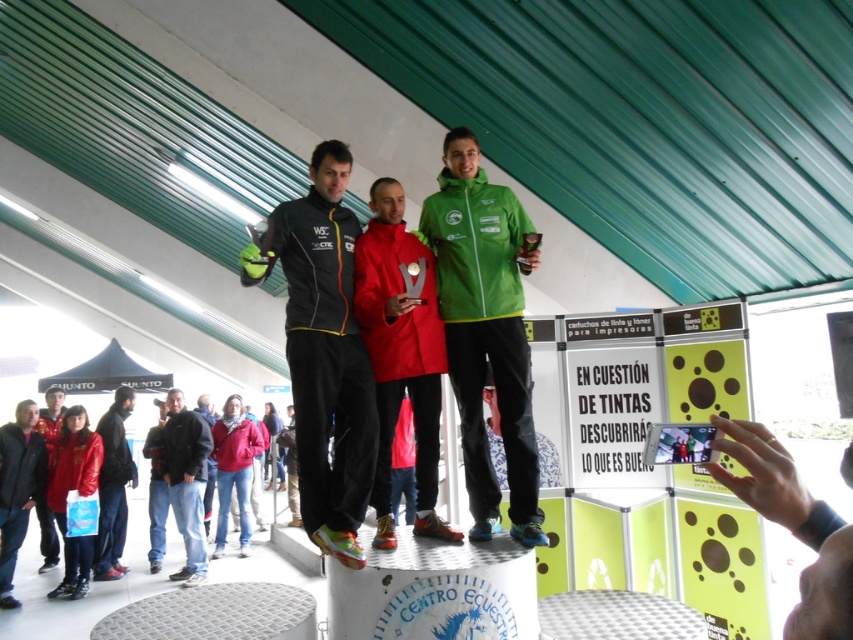
Question: Which point appears closest to the camera in this image?

Choices:
 (A) (131, 465)
 (B) (62, 582)
 (C) (119, 365)
 (D) (201, 464)

Answer: (B)

Question: Does green matte jacket at center have a lesser width compared to dark blue jacket at center?

Choices:
 (A) yes
 (B) no

Answer: (A)

Question: Among these points, which one is nearest to the camera?

Choices:
 (A) (71, 438)
 (B) (112, 515)
 (C) (169, 488)

Answer: (A)

Question: Does matte black jacket at center appear over matte red jacket at lower left?

Choices:
 (A) yes
 (B) no

Answer: (A)

Question: Which of the following is the farthest from the observer?

Choices:
 (A) red fabric jacket at lower left
 (B) red matte jacket at lower left
 (C) green matte jacket at center

Answer: (A)

Question: Does matte black jacket at center appear under matte red jacket at lower left?

Choices:
 (A) no
 (B) yes

Answer: (A)